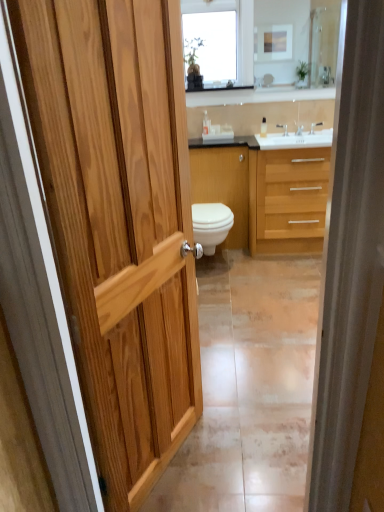
Locate an element on the screen. This screenshot has height=512, width=384. silver metallic faucet at upper center is located at coordinates (283, 128).

This screenshot has width=384, height=512. Describe the element at coordinates (264, 193) in the screenshot. I see `light wood/woodenmaterial/texture bathroom cabinet at center` at that location.

Describe the element at coordinates (212, 37) in the screenshot. I see `clear glass window at upper center` at that location.

The image size is (384, 512). What do you see at coordinates (274, 37) in the screenshot?
I see `clear glass mirror at upper center` at bounding box center [274, 37].

Describe the element at coordinates (211, 225) in the screenshot. Image resolution: width=384 pixels, height=512 pixels. I see `white glossy toilet at center` at that location.

Image resolution: width=384 pixels, height=512 pixels. I want to click on silver metallic faucet at upper center, so click(x=283, y=128).

Is light wood/woodenmaterial/texture bathroom cabinet at center facing towards silver metallic faucet at upper center?

No, light wood/woodenmaterial/texture bathroom cabinet at center is not oriented towards silver metallic faucet at upper center.

From the image's perspective, is light wood/woodenmaterial/texture bathroom cabinet at center located beneath silver metallic faucet at upper center?

Correct, light wood/woodenmaterial/texture bathroom cabinet at center appears lower than silver metallic faucet at upper center in the image.

From the picture: Which point is more distant from viewer, [325,177] or [283,129]?

Point [283,129]

Find the location of `bathroom cabinet on the right of silver metallic faucet at upper center`. bathroom cabinet on the right of silver metallic faucet at upper center is located at coordinates (264, 193).

Which object is more forward, white glossy cabinet at center or clear glass window at upper center?

clear glass window at upper center.

Considering the relative positions of white glossy cabinet at center and clear glass window at upper center in the image provided, is white glossy cabinet at center to the left of clear glass window at upper center from the viewer's perspective?

No.

Is white glossy cabinet at center bigger than clear glass window at upper center?

Correct, white glossy cabinet at center is larger in size than clear glass window at upper center.

Is clear glass window at upper center surrounded by white glossy cabinet at center?

No, white glossy cabinet at center does not contain clear glass window at upper center.

Is clear glass window at upper center situated inside white glossy toilet at center or outside?

The correct answer is: outside.

Does point (234, 27) come farther from viewer compared to point (216, 229)?

Yes.

The image size is (384, 512). I want to click on toilet located underneath the clear glass window at upper center (from a real-world perspective), so click(x=211, y=225).

Considering the relative positions of clear glass window at upper center and white glossy toilet at center in the image provided, is clear glass window at upper center to the left of white glossy toilet at center from the viewer's perspective?

No, clear glass window at upper center is not to the left of white glossy toilet at center.

Could you tell me if silver metallic faucet at upper center is facing clear glass window at upper center?

No, silver metallic faucet at upper center is not oriented towards clear glass window at upper center.

Is silver metallic faucet at upper center wider than clear glass window at upper center?

In fact, silver metallic faucet at upper center might be narrower than clear glass window at upper center.

Is silver metallic faucet at upper center not near clear glass window at upper center?

No, there isn't a large distance between silver metallic faucet at upper center and clear glass window at upper center.

Measure the distance between silver metallic faucet at upper center and white glossy cabinet at center.

A distance of 26.16 inches exists between silver metallic faucet at upper center and white glossy cabinet at center.

Find the location of a particular element. cabinetry lying on the left of silver metallic faucet at upper center is located at coordinates (223, 186).

Does silver metallic faucet at upper center appear on the left side of white glossy cabinet at center?

In fact, silver metallic faucet at upper center is to the right of white glossy cabinet at center.

Consider the image. From the image's perspective, does silver metallic faucet at upper center appear higher than white glossy cabinet at center?

Correct, silver metallic faucet at upper center appears higher than white glossy cabinet at center in the image.

Is clear glass mirror at upper center facing towards white glossy cabinet at center?

No, clear glass mirror at upper center is not oriented towards white glossy cabinet at center.

From the image's perspective, is clear glass mirror at upper center on white glossy cabinet at center?

Yes, from the image's perspective, clear glass mirror at upper center is above white glossy cabinet at center.

Can you confirm if clear glass mirror at upper center is taller than white glossy cabinet at center?

In fact, clear glass mirror at upper center may be shorter than white glossy cabinet at center.

Is white glossy cabinet at center a part of clear glass mirror at upper center?

No, white glossy cabinet at center is not surrounded by clear glass mirror at upper center.

Which of these two, silver metallic faucet at upper center or light wood/woodenmaterial/texture bathroom cabinet at center, stands shorter?

silver metallic faucet at upper center.

Which object is positioned more to the right, silver metallic faucet at upper center or light wood/woodenmaterial/texture bathroom cabinet at center?

From the viewer's perspective, light wood/woodenmaterial/texture bathroom cabinet at center appears more on the right side.

How different are the orientations of silver metallic faucet at upper center and light wood/woodenmaterial/texture bathroom cabinet at center in degrees?

The angle between the facing direction of silver metallic faucet at upper center and the facing direction of light wood/woodenmaterial/texture bathroom cabinet at center is 0.973 degrees.

From the image's perspective, which one is positioned higher, silver metallic faucet at upper center or light wood/woodenmaterial/texture bathroom cabinet at center?

silver metallic faucet at upper center appears higher in the image.

Find the location of a particular element. This screenshot has height=512, width=384. tap behind the light wood/woodenmaterial/texture bathroom cabinet at center is located at coordinates (283, 128).

In order to click on window located above the white glossy cabinet at center (from a real-world perspective) in this screenshot , I will do `click(212, 37)`.

Based on their spatial positions, is white glossy toilet at center or white glossy cabinet at center closer to clear glass window at upper center?

The object closer to clear glass window at upper center is white glossy cabinet at center.

Which object lies nearer to the anchor point white glossy cabinet at center, light wood/woodenmaterial/texture bathroom cabinet at center or silver metallic faucet at upper center?

light wood/woodenmaterial/texture bathroom cabinet at center is positioned closer to the anchor white glossy cabinet at center.

Looking at this image, considering their positions, is clear glass window at upper center positioned closer to white glossy toilet at center than white glossy cabinet at center?

Based on the image, white glossy cabinet at center appears to be nearer to white glossy toilet at center.

Based on their spatial positions, is clear glass mirror at upper center or white glossy cabinet at center closer to clear glass window at upper center?

→ clear glass mirror at upper center lies closer to clear glass window at upper center than the other object.

When comparing their distances from clear glass mirror at upper center, does silver metallic faucet at upper center or light wood/woodenmaterial/texture bathroom cabinet at center seem closer?

silver metallic faucet at upper center lies closer to clear glass mirror at upper center than the other object.

From the image, which object appears to be farther from light wood/woodenmaterial/texture bathroom cabinet at center, clear glass window at upper center or silver metallic faucet at upper center?

clear glass window at upper center is positioned further to the anchor light wood/woodenmaterial/texture bathroom cabinet at center.

Based on their spatial positions, is silver metallic faucet at upper center or clear glass mirror at upper center further from white glossy cabinet at center?

clear glass mirror at upper center lies further to white glossy cabinet at center than the other object.

Considering their positions, is white glossy toilet at center positioned further to clear glass window at upper center than silver metallic faucet at upper center?

white glossy toilet at center lies further to clear glass window at upper center than the other object.

Locate an element on the screen. The width and height of the screenshot is (384, 512). tap between clear glass mirror at upper center and white glossy cabinet at center in the vertical direction is located at coordinates (283, 128).

Image resolution: width=384 pixels, height=512 pixels. Find the location of `cabinetry between clear glass mirror at upper center and light wood/woodenmaterial/texture bathroom cabinet at center in the vertical direction`. cabinetry between clear glass mirror at upper center and light wood/woodenmaterial/texture bathroom cabinet at center in the vertical direction is located at coordinates (223, 186).

This screenshot has height=512, width=384. Find the location of `tap between clear glass window at upper center and light wood/woodenmaterial/texture bathroom cabinet at center in the vertical direction`. tap between clear glass window at upper center and light wood/woodenmaterial/texture bathroom cabinet at center in the vertical direction is located at coordinates (283, 128).

Identify the location of mirror between clear glass window at upper center and white glossy cabinet at center from top to bottom. Image resolution: width=384 pixels, height=512 pixels. (274, 37).